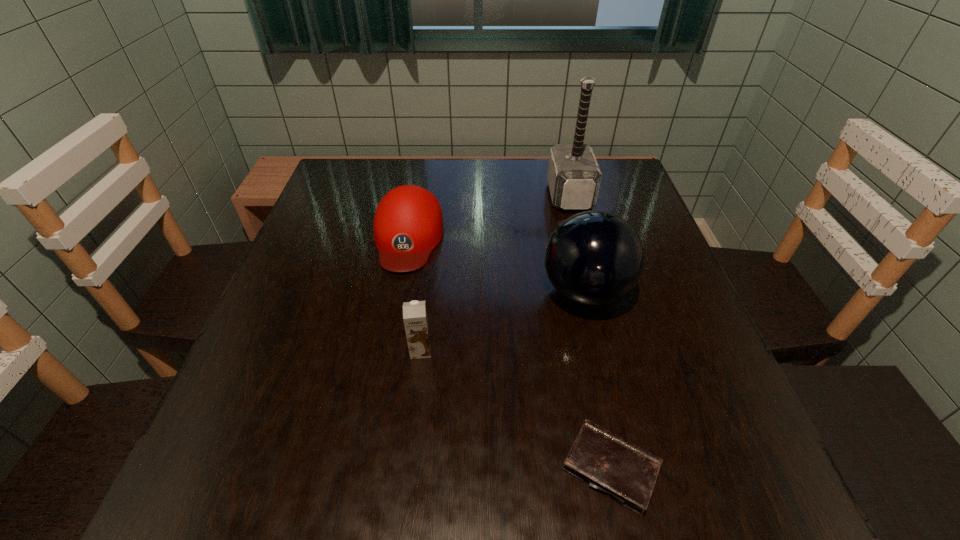
Where is `the tallest object`? the tallest object is located at coordinates (573, 176).

Find the location of `the second tallest object`. the second tallest object is located at coordinates (594, 258).

I want to click on the fourth farthest object, so click(x=415, y=319).

This screenshot has height=540, width=960. I want to click on baseball cap, so click(408, 224).

The height and width of the screenshot is (540, 960). I want to click on diary, so click(626, 473).

Where is `the shortest object`? the shortest object is located at coordinates pyautogui.click(x=626, y=473).

Where is `vacant area situated for striking with the head of the tallest object`? This screenshot has height=540, width=960. vacant area situated for striking with the head of the tallest object is located at coordinates (421, 195).

Locate an element on the screen. The image size is (960, 540). vacant point located 0.210m for striking with the head of the tallest object is located at coordinates (470, 195).

The width and height of the screenshot is (960, 540). In order to click on vacant space located for striking with the head of the tallest object in this screenshot , I will do `click(455, 195)`.

This screenshot has height=540, width=960. I want to click on vacant area situated 0.400m on the side of the bowling ball with the finger holes, so coord(348,293).